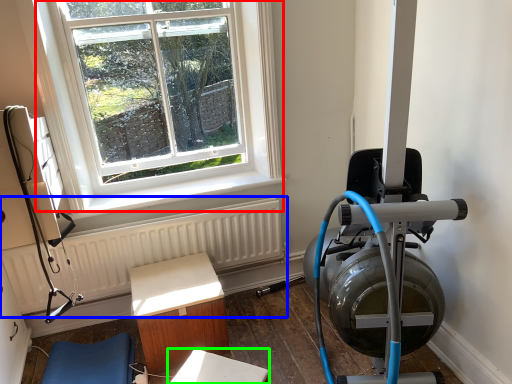
Question: Which object is the closest to the window (highlighted by a red box)? Choose among these: radiator (highlighted by a blue box) or table (highlighted by a green box).

Choices:
 (A) radiator
 (B) table

Answer: (A)